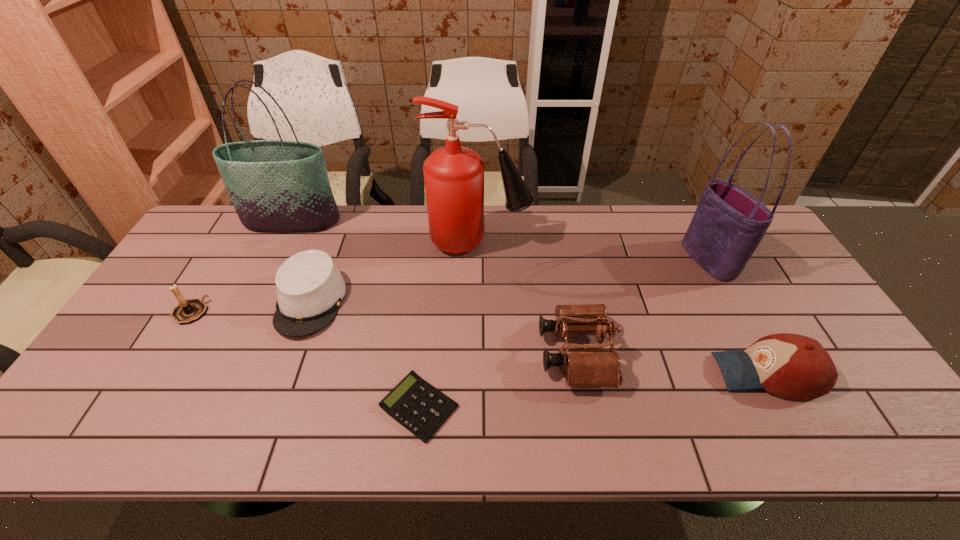
At what (x,y) coordinates should I click in order to perform the action: click on fire extinguisher present at the far edge. Please return your answer as a coordinate pair (x, y). Image resolution: width=960 pixels, height=540 pixels. Looking at the image, I should click on (454, 175).

Locate an element on the screen. Image resolution: width=960 pixels, height=540 pixels. object present at the near edge is located at coordinates (414, 403).

The width and height of the screenshot is (960, 540). What are the coordinates of `tote bag present at the left edge` in the screenshot? It's located at (279, 186).

At what (x,y) coordinates should I click in order to perform the action: click on candle holder present at the left edge. Please return your answer as a coordinate pair (x, y). This screenshot has height=540, width=960. Looking at the image, I should click on (188, 311).

The height and width of the screenshot is (540, 960). I want to click on tote bag that is positioned at the right edge, so click(x=729, y=223).

This screenshot has width=960, height=540. I want to click on baseball cap located in the right edge section of the desktop, so click(x=792, y=366).

The height and width of the screenshot is (540, 960). I want to click on object at the far left corner, so tap(279, 186).

Find the location of a particular element. The image size is (960, 540). object that is at the far right corner is located at coordinates (729, 223).

Identify the location of free spot at the far edge of the desktop. The height and width of the screenshot is (540, 960). (245, 249).

In the image, there is a desktop. What are the coordinates of `vacant space at the near edge` in the screenshot? It's located at (641, 445).